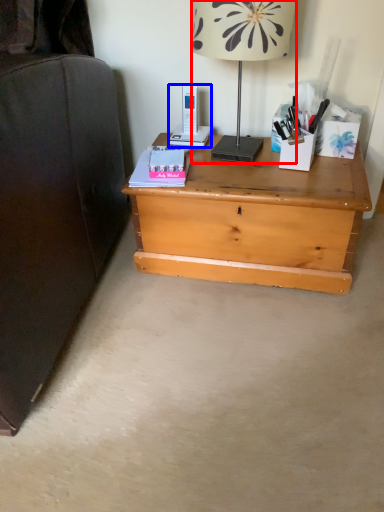
Question: Which point is further to the camera, lamp (highlighted by a red box) or gadget (highlighted by a blue box)?

Choices:
 (A) lamp
 (B) gadget

Answer: (B)